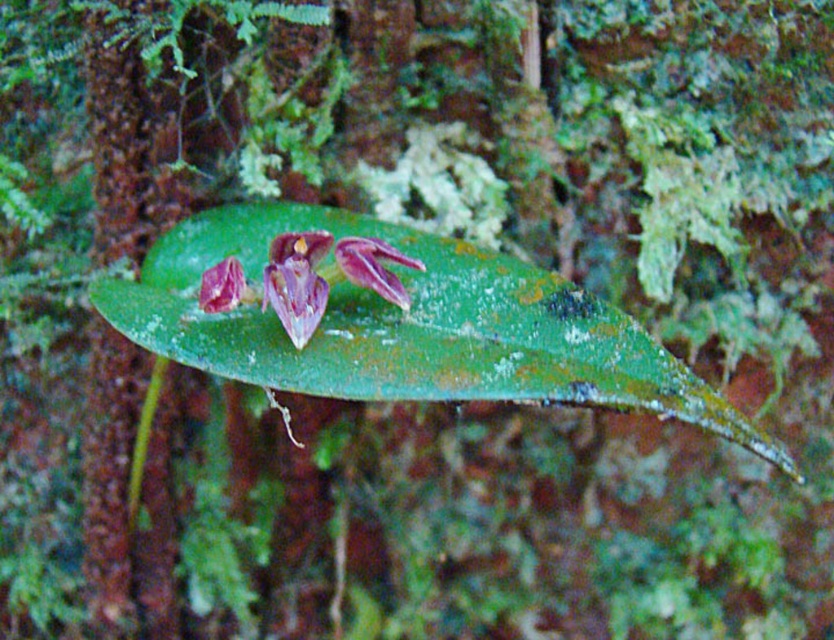
Question: Which point is farther from the camera taking this photo?

Choices:
 (A) (333, 291)
 (B) (239, 282)

Answer: (A)

Question: Among these objects, which one is nearest to the camera?

Choices:
 (A) matte purple orchid at center
 (B) purple matte orchid at center
 (C) green matte leaf at center

Answer: (C)

Question: Estimate the real-world distances between objects in this image. Which object is closer to the matte purple orchid at center?

Choices:
 (A) purple matte flower at center
 (B) purple matte orchid at center

Answer: (A)

Question: Is green matte leaf at center to the right of purple matte orchid at center from the viewer's perspective?

Choices:
 (A) no
 (B) yes

Answer: (B)

Question: Does green matte leaf at center appear over matte purple orchid at center?

Choices:
 (A) yes
 (B) no

Answer: (B)

Question: Considering the relative positions of green matte leaf at center and purple matte flower at center in the image provided, where is green matte leaf at center located with respect to purple matte flower at center?

Choices:
 (A) below
 (B) above

Answer: (A)